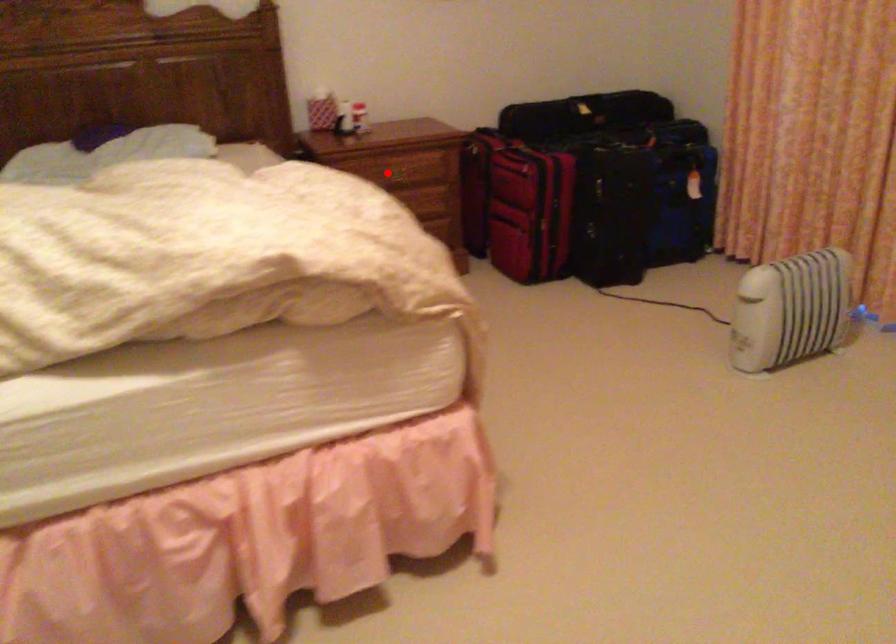
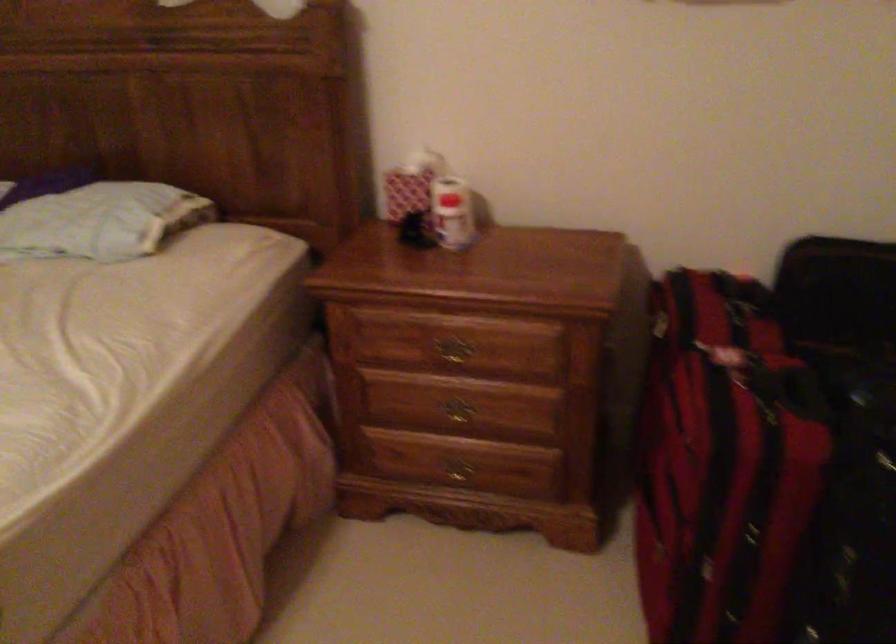
Question: I am providing you with two images of the same scene from different viewpoints. Image1 has a red point marked. In image2, the corresponding 3D location appears at what relative position? Reply with the corresponding letter.

Choices:
 (A) Closer
 (B) Farther

Answer: (A)